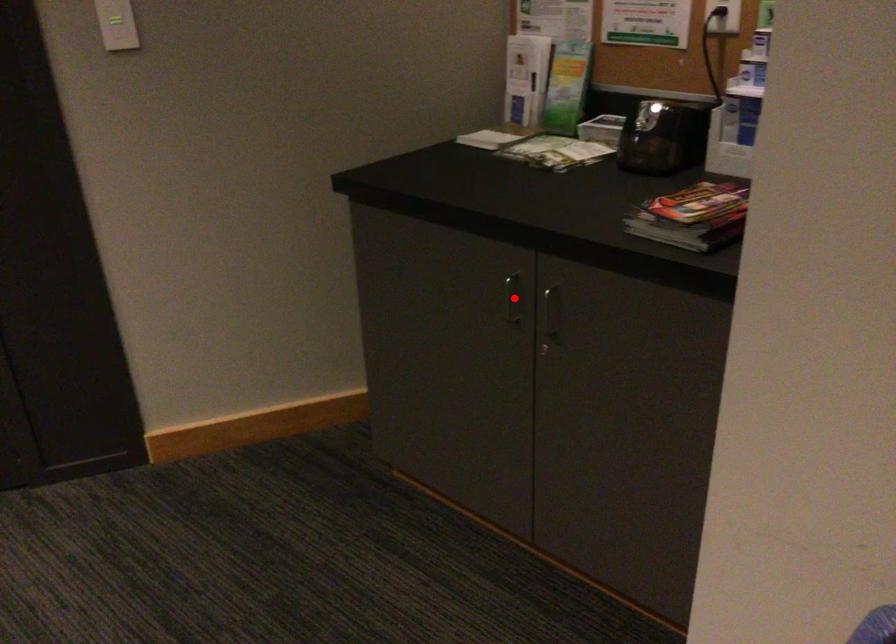
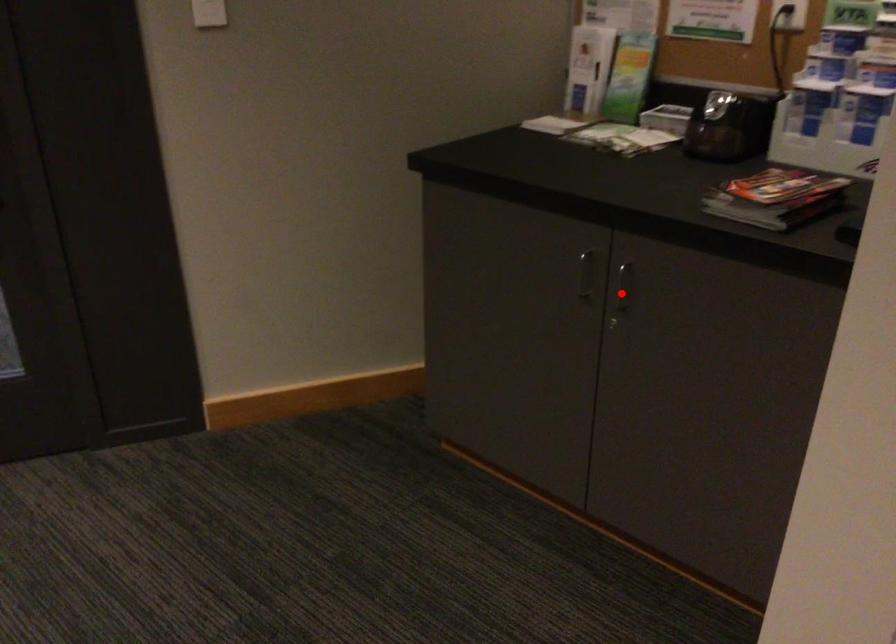
I am providing you with two images of the same scene from different viewpoints. A red point is marked on the first image and another point is marked on the second image. Does the point marked in image1 correspond to the same location as the one in image2?

No